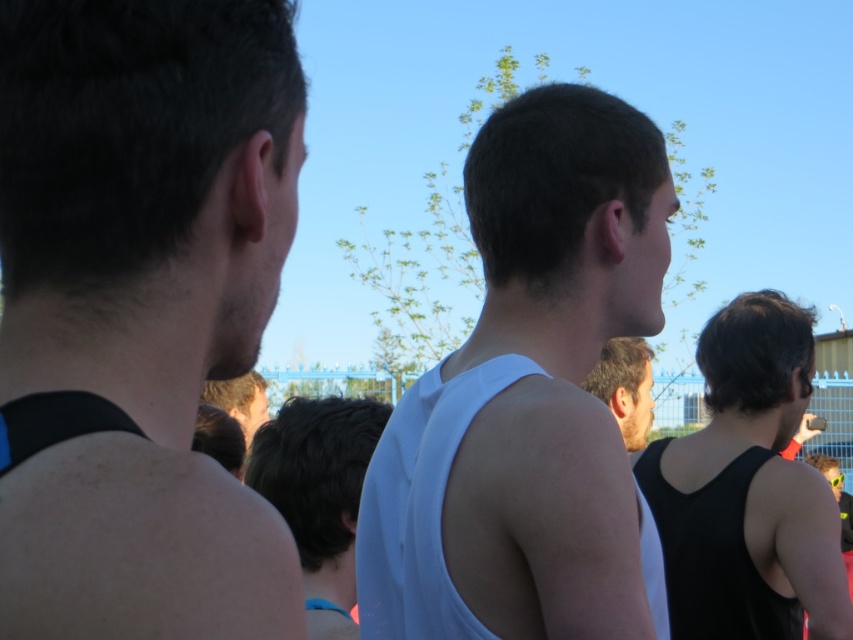
Can you confirm if black matte tank top at left is positioned below matte black tank top at center?

No.

Who is more distant from viewer, (x=213, y=186) or (x=225, y=412)?

The point (x=225, y=412) is more distant.

You are a GUI agent. You are given a task and a screenshot of the screen. Output one action in this format:
    pyautogui.click(x=<x>, y=<y>)
    Task: Click on the black matte tank top at left
    The width and height of the screenshot is (853, 640).
    Given the screenshot: What is the action you would take?
    pyautogui.click(x=142, y=305)

Who is higher up, dark brown hair at center or matte black tank top at center?

matte black tank top at center is higher up.

Which is behind, point (294, 506) or point (231, 394)?

Point (231, 394)

At what (x,y) coordinates should I click in order to perform the action: click on dark brown hair at center. Please return your answer as a coordinate pair (x, y). Looking at the image, I should click on (318, 493).

At what (x,y) coordinates should I click in order to perform the action: click on dark brown hair at center. Please return your answer as a coordinate pair (x, y). The width and height of the screenshot is (853, 640). Looking at the image, I should click on (318, 493).

Does black matte tank top at left lie behind dark brown hair at center?

That is False.

Which is more to the right, black matte tank top at left or dark brown hair at center?

black matte tank top at left is more to the right.

Describe the element at coordinates (142, 305) in the screenshot. The width and height of the screenshot is (853, 640). I see `black matte tank top at left` at that location.

Where is `black matte tank top at left`? black matte tank top at left is located at coordinates (142, 305).